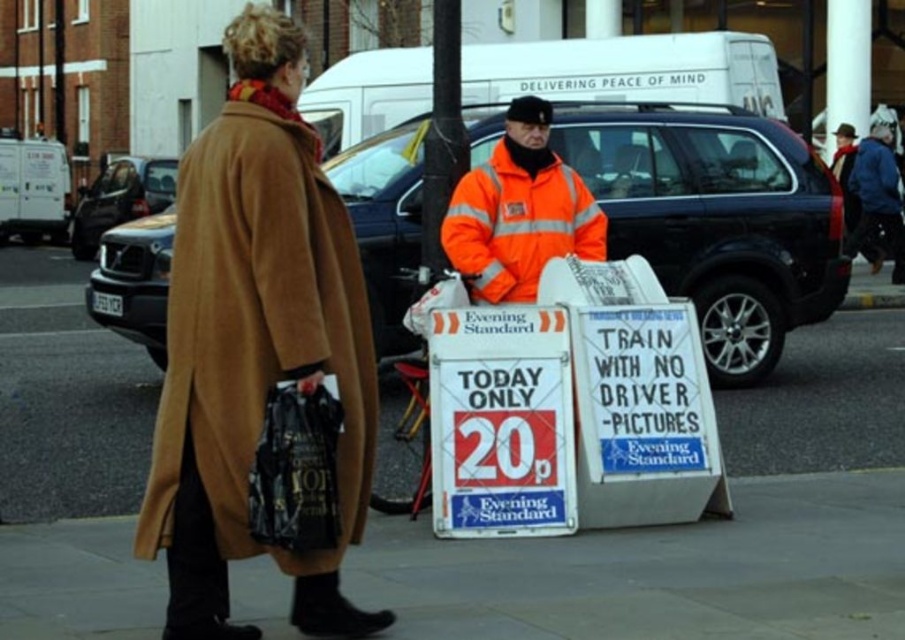
Who is shorter, smooth concrete pavement at lower center or tan woolen coat at left?

smooth concrete pavement at lower center is shorter.

Does point (716, 604) come closer to viewer compared to point (330, 269)?

No, it is behind (330, 269).

Measure the distance between point [742,611] and camera.

The distance of point [742,611] from camera is 5.63 meters.

You are a GUI agent. You are given a task and a screenshot of the screen. Output one action in this format:
    pyautogui.click(x=<x>, y=<y>)
    Task: Click on the smooth concrete pavement at lower center
    The height and width of the screenshot is (640, 905).
    Given the screenshot: What is the action you would take?
    pyautogui.click(x=660, y=572)

Does smooth concrete pavement at lower center appear over high-visibility orange jacket at center?

Incorrect, smooth concrete pavement at lower center is not positioned above high-visibility orange jacket at center.

Does smooth concrete pavement at lower center have a lesser height compared to high-visibility orange jacket at center?

Correct, smooth concrete pavement at lower center is not as tall as high-visibility orange jacket at center.

Who is more distant from viewer, [637,544] or [559,232]?

The point [559,232] is behind.

I want to click on smooth concrete pavement at lower center, so click(660, 572).

Does tan woolen coat at left have a greater height compared to high-visibility orange jacket at center?

Indeed, tan woolen coat at left has a greater height compared to high-visibility orange jacket at center.

Between tan woolen coat at left and high-visibility orange jacket at center, which one has less height?

high-visibility orange jacket at center

Is point (310, 292) closer to camera compared to point (501, 225)?

Yes.

Where is `tan woolen coat at left`? Image resolution: width=905 pixels, height=640 pixels. tan woolen coat at left is located at coordinates (256, 342).